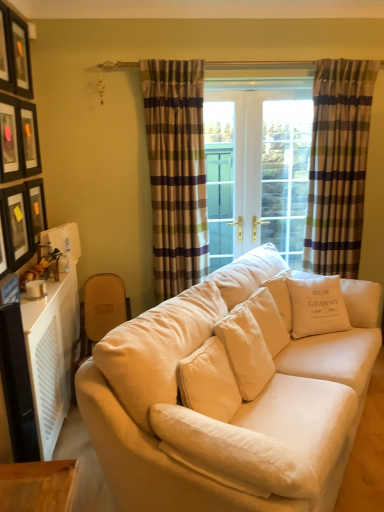
Question: Is matte black picture frame at upper left, arranged as the 6th picture frame when ordered from the bottom, taller than matte black picture frame at upper left, acting as the 3th picture frame starting from the bottom?

Choices:
 (A) yes
 (B) no

Answer: (B)

Question: Is matte black picture frame at upper left, the 1th picture frame when ordered from top to bottom, positioned with its back to matte black picture frame at upper left, the 4th picture frame when ordered from top to bottom?

Choices:
 (A) no
 (B) yes

Answer: (A)

Question: From a real-world perspective, is matte black picture frame at upper left, the 1th picture frame when ordered from top to bottom, below matte black picture frame at upper left, the 4th picture frame when ordered from top to bottom?

Choices:
 (A) no
 (B) yes

Answer: (A)

Question: Could you tell me if matte black picture frame at upper left, arranged as the 6th picture frame when ordered from the bottom, is facing matte black picture frame at upper left, acting as the 3th picture frame starting from the bottom?

Choices:
 (A) no
 (B) yes

Answer: (A)

Question: Is the depth of matte black picture frame at upper left, the 1th picture frame when ordered from top to bottom, greater than that of matte black picture frame at upper left, the 4th picture frame when ordered from top to bottom?

Choices:
 (A) no
 (B) yes

Answer: (B)

Question: Looking at their shapes, would you say matte black picture frame at upper left, marked as the fourth picture frame in a bottom-to-top arrangement, is wider or thinner than white soft cushion at center, which appears as the second pillow when viewed from the top?

Choices:
 (A) wide
 (B) thin

Answer: (B)

Question: Based on their sizes in the image, would you say matte black picture frame at upper left, marked as the fourth picture frame in a bottom-to-top arrangement, is bigger or smaller than white soft cushion at center, which is counted as the second pillow, starting from the back?

Choices:
 (A) big
 (B) small

Answer: (B)

Question: From a real-world perspective, is matte black picture frame at upper left, marked as the fourth picture frame in a bottom-to-top arrangement, above or below white soft cushion at center, which ranks as the 1th pillow in bottom-to-top order?

Choices:
 (A) above
 (B) below

Answer: (A)

Question: Is point (34, 169) positioned closer to the camera than point (241, 439)?

Choices:
 (A) farther
 (B) closer

Answer: (A)

Question: Considering the positions of matte black picture frame at upper left, which appears as the fifth picture frame when viewed from the top, and beige fabric couch at center in the image, is matte black picture frame at upper left, which appears as the fifth picture frame when viewed from the top, taller or shorter than beige fabric couch at center?

Choices:
 (A) short
 (B) tall

Answer: (A)

Question: Relative to beige fabric couch at center, is matte black picture frame at upper left, the second picture frame positioned from the bottom, in front or behind?

Choices:
 (A) front
 (B) behind

Answer: (B)

Question: Is matte black picture frame at upper left, which appears as the fifth picture frame when viewed from the top, inside or outside of beige fabric couch at center?

Choices:
 (A) inside
 (B) outside

Answer: (B)

Question: In terms of size, does matte black picture frame at upper left, the second picture frame positioned from the bottom, appear bigger or smaller than beige fabric couch at center?

Choices:
 (A) big
 (B) small

Answer: (B)

Question: Looking at the image, does plaid fabric curtain at center, which is the second curtain from right to left, seem bigger or smaller compared to matte black picture frame at upper left, the 1th picture frame positioned from the bottom?

Choices:
 (A) small
 (B) big

Answer: (B)

Question: Is point (173, 89) positioned closer to the camera than point (14, 202)?

Choices:
 (A) farther
 (B) closer

Answer: (A)